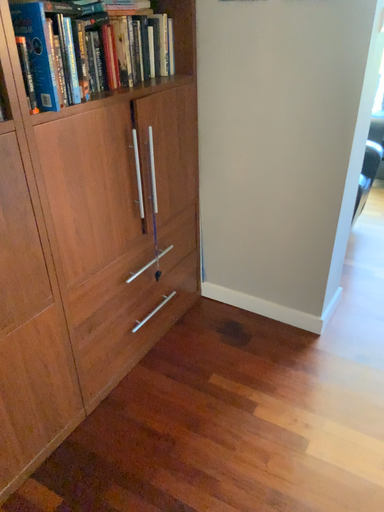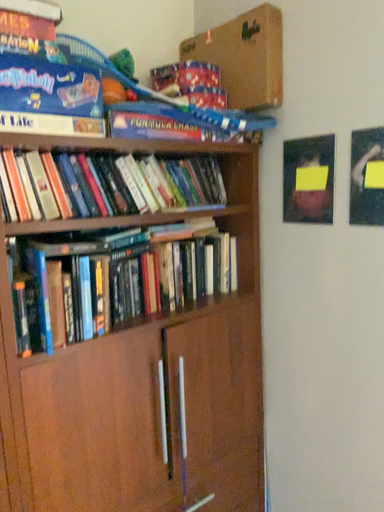
Question: Which way did the camera rotate in the video?

Choices:
 (A) rotated left
 (B) rotated right

Answer: (A)